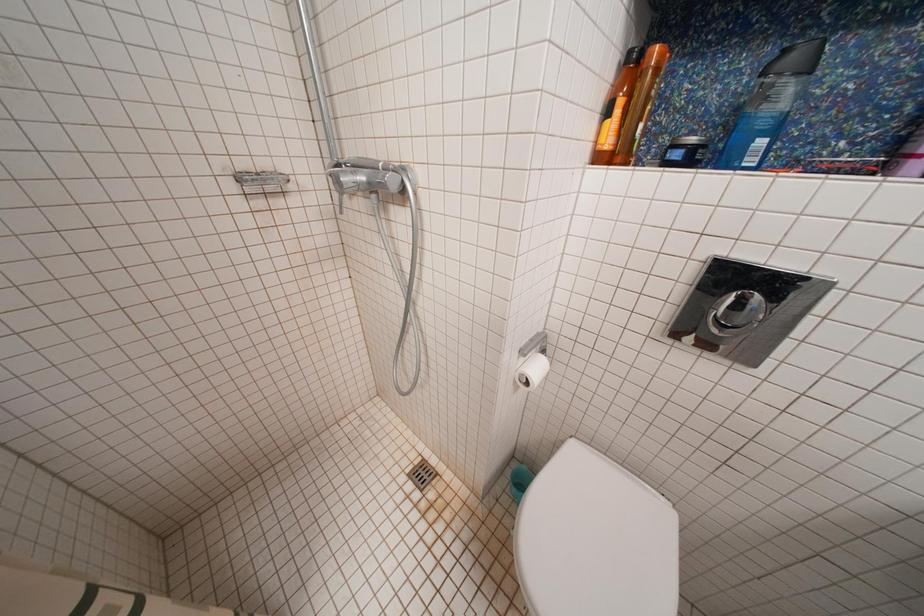
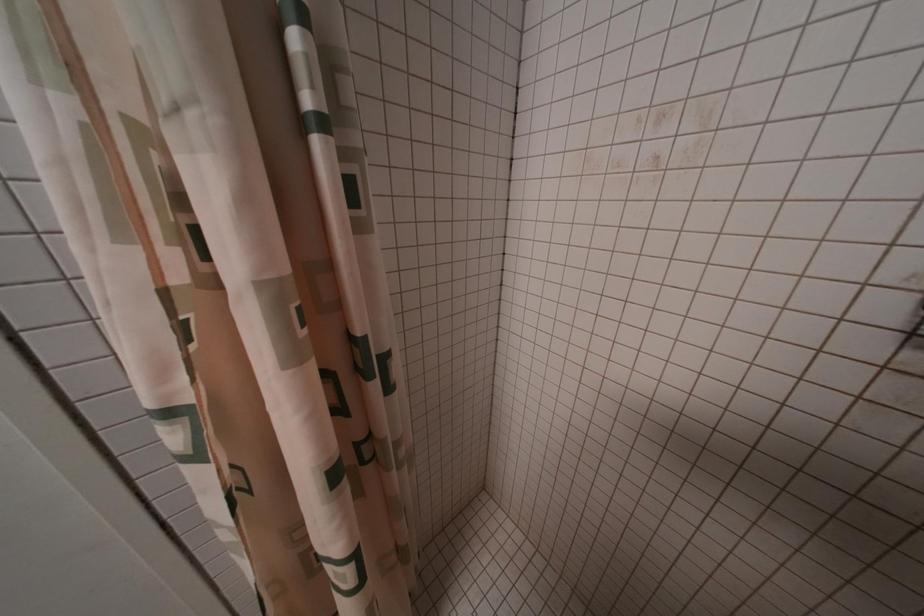
How did the camera likely rotate?

The camera's rotation is toward left-down.